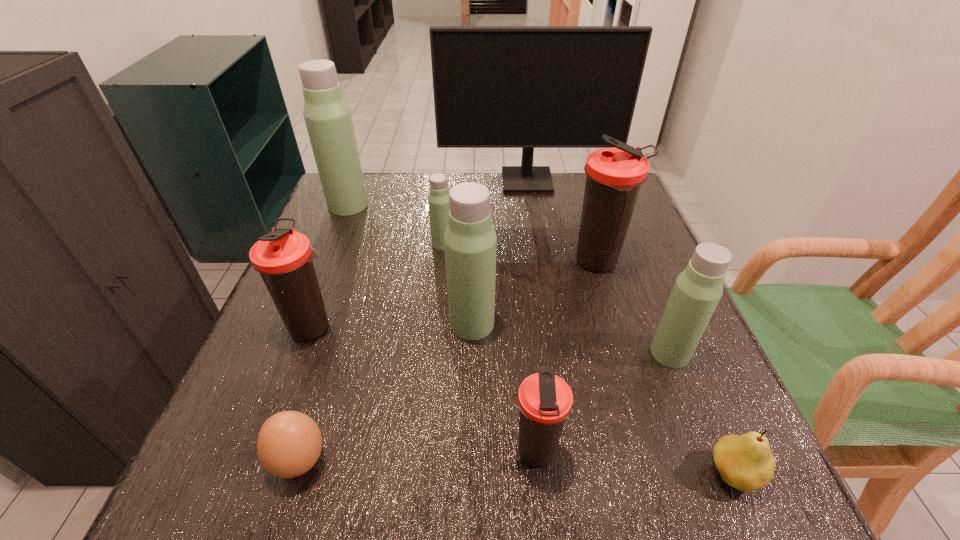
Where is `free space at the left edge`? Image resolution: width=960 pixels, height=540 pixels. free space at the left edge is located at coordinates point(359,222).

Image resolution: width=960 pixels, height=540 pixels. What are the coordinates of `vacant space at the right edge` in the screenshot? It's located at (632, 351).

You are a GUI agent. You are given a task and a screenshot of the screen. Output one action in this format:
    pyautogui.click(x=<x>, y=<y>)
    Task: Click on the vacant point located between the farthest brown thermos bottle and the pear
    Image resolution: width=960 pixels, height=540 pixels.
    Given the screenshot: What is the action you would take?
    pyautogui.click(x=665, y=368)

Identify the location of vacant space that is in between the pear and the rightmost light thermos bottle. (701, 414).

Where is `blank region between the third light thermos bottle from right to left and the leftmost brown thermos bottle`? This screenshot has width=960, height=540. blank region between the third light thermos bottle from right to left and the leftmost brown thermos bottle is located at coordinates (377, 285).

Find the location of a particular element. unoccupied area between the rightmost light thermos bottle and the pear is located at coordinates (701, 414).

Where is `unoccupied area between the second farthest light thermos bottle and the second farthest brown thermos bottle`? unoccupied area between the second farthest light thermos bottle and the second farthest brown thermos bottle is located at coordinates (377, 285).

Find the location of `free space between the brown boiled egg and the second brown thermos bottle from right to left`. free space between the brown boiled egg and the second brown thermos bottle from right to left is located at coordinates (417, 456).

Where is `empty location between the biggest brown thermos bottle and the fourth thermos bottle from right to left`? empty location between the biggest brown thermos bottle and the fourth thermos bottle from right to left is located at coordinates (535, 293).

Identify the location of free space between the rightmost light thermos bottle and the third nearest light thermos bottle. The height and width of the screenshot is (540, 960). (557, 299).